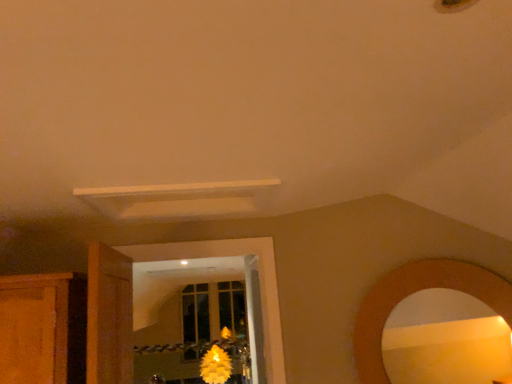
Question: Considering the relative sizes of yellow matte flower at center and wooden mirror at lower right in the image provided, is yellow matte flower at center thinner than wooden mirror at lower right?

Choices:
 (A) no
 (B) yes

Answer: (A)

Question: Considering the relative sizes of yellow matte flower at center and wooden mirror at lower right in the image provided, is yellow matte flower at center bigger than wooden mirror at lower right?

Choices:
 (A) no
 (B) yes

Answer: (B)

Question: From a real-world perspective, is yellow matte flower at center over wooden mirror at lower right?

Choices:
 (A) yes
 (B) no

Answer: (B)

Question: Is there a large distance between yellow matte flower at center and wooden mirror at lower right?

Choices:
 (A) yes
 (B) no

Answer: (A)

Question: Is yellow matte flower at center taller than wooden mirror at lower right?

Choices:
 (A) yes
 (B) no

Answer: (A)

Question: In the image, is yellow matte flower at center positioned in front of or behind wooden door at left?

Choices:
 (A) behind
 (B) front

Answer: (A)

Question: Looking at their shapes, would you say yellow matte flower at center is wider or thinner than wooden door at left?

Choices:
 (A) wide
 (B) thin

Answer: (A)

Question: From a real-world perspective, is yellow matte flower at center physically located above or below wooden door at left?

Choices:
 (A) below
 (B) above

Answer: (A)

Question: Choose the correct answer: Is yellow matte flower at center inside wooden door at left or outside it?

Choices:
 (A) outside
 (B) inside

Answer: (A)

Question: From a real-world perspective, is wooden mirror at lower right physically located above or below yellow matte flower at center?

Choices:
 (A) above
 (B) below

Answer: (A)

Question: Is wooden mirror at lower right situated inside yellow matte flower at center or outside?

Choices:
 (A) inside
 (B) outside

Answer: (B)

Question: Relative to yellow matte flower at center, is wooden mirror at lower right in front or behind?

Choices:
 (A) front
 (B) behind

Answer: (A)

Question: From the image's perspective, is wooden mirror at lower right above or below yellow matte flower at center?

Choices:
 (A) below
 (B) above

Answer: (B)

Question: Is wooden door at left wider or thinner than wooden mirror at lower right?

Choices:
 (A) thin
 (B) wide

Answer: (B)

Question: From a real-world perspective, is wooden door at left above or below wooden mirror at lower right?

Choices:
 (A) above
 (B) below

Answer: (A)